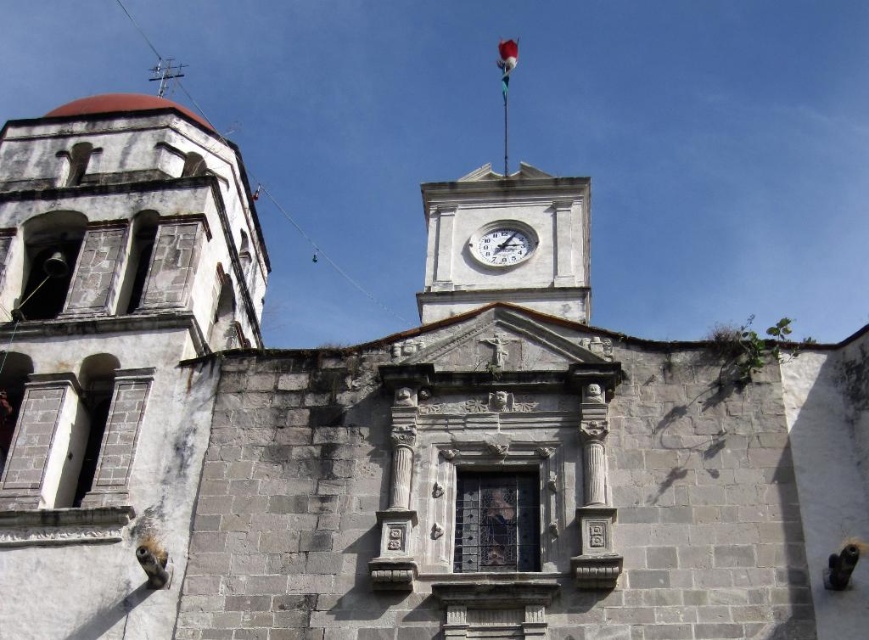
You are standing in front of the historic stone church and looking at the white stone clock tower at upper center and the white glossy clock at upper center. Which object is nearer to you?

The white stone clock tower at upper center is closer to the viewer than the white glossy clock at upper center.

Looking at this image, you are a maintenance worker needing to inspect both the white stone clock tower at upper center and the white glossy clock at upper center. The ladder you have can reach up to 10 meters. Can you safely inspect both objects with the ladder you have?

The distance between the white stone clock tower at upper center and the white glossy clock at upper center is 11.03 meters, which exceeds the ladder capacity of 10 meters. Therefore, the ladder cannot reach both objects safely.

You are an architect assessing the church facade. You notice the white stone clock tower at upper center and the white glossy clock at upper center. Which of these two objects has a greater width?

The white stone clock tower at upper center has a greater width than the white glossy clock at upper center.